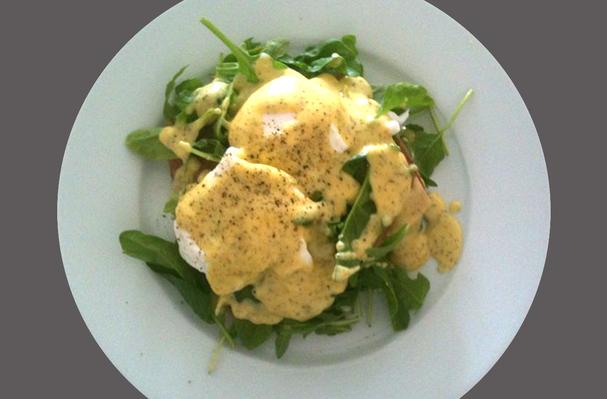
I want to click on top portion of plate, so click(310, 3).